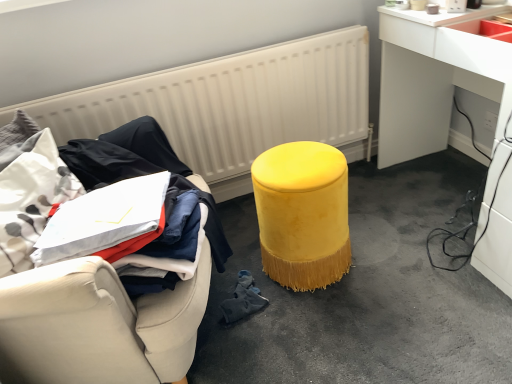
The width and height of the screenshot is (512, 384). Identify the location of vacant area that lies in front of velvet yellow stool at center. (325, 323).